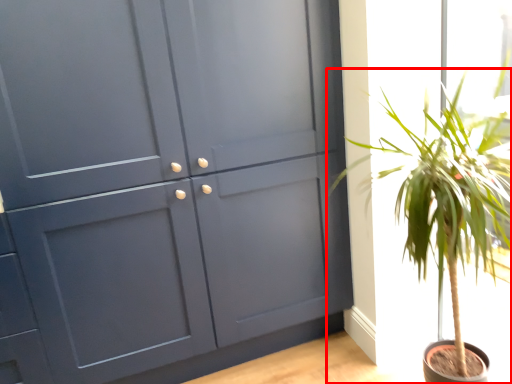
Question: From the image's perspective, what is the correct spatial positioning of houseplant (annotated by the red box) in reference to cupboard?

Choices:
 (A) above
 (B) below

Answer: (B)